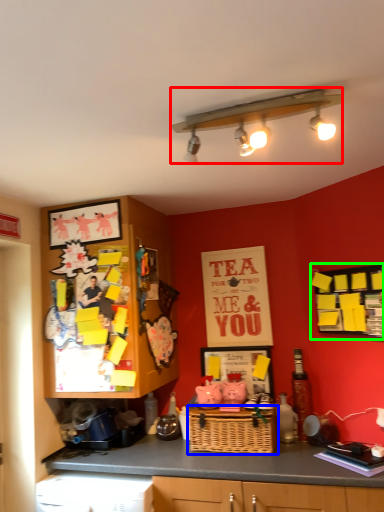
Question: Which is nearer to the light fixture (highlighted by a red box)? basket (highlighted by a blue box) or bulletin board (highlighted by a green box).

Choices:
 (A) basket
 (B) bulletin board

Answer: (B)